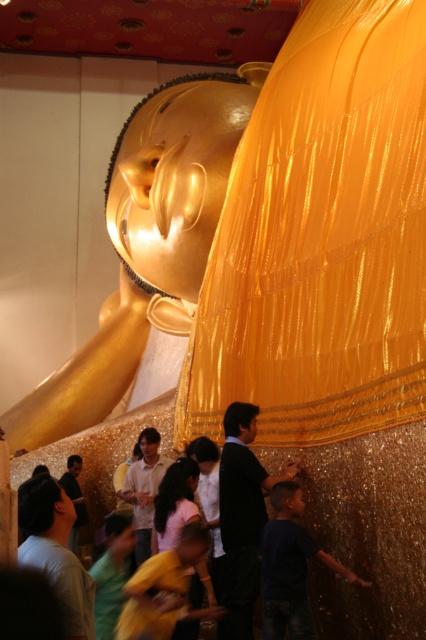
Where is `gold shiny statue at center`? This screenshot has height=640, width=426. gold shiny statue at center is located at coordinates (147, 243).

From the picture: Can you confirm if gold shiny statue at center is thinner than matte gold monk at center?

No, gold shiny statue at center is not thinner than matte gold monk at center.

The height and width of the screenshot is (640, 426). What do you see at coordinates (147, 243) in the screenshot? I see `gold shiny statue at center` at bounding box center [147, 243].

This screenshot has height=640, width=426. In order to click on gold shiny statue at center in this screenshot , I will do point(147,243).

Who is shorter, black matte monk at center or matte gold monk at center?

matte gold monk at center

Does black matte monk at center appear on the right side of matte gold monk at center?

Yes, black matte monk at center is to the right of matte gold monk at center.

This screenshot has width=426, height=640. I want to click on black matte monk at center, so click(241, 518).

Does gold shiny statue at center appear under black matte monk at center?

Actually, gold shiny statue at center is above black matte monk at center.

Who is shorter, gold shiny statue at center or black matte monk at center?

black matte monk at center is shorter.

Who is more forward, (95, 403) or (241, 404)?

Point (241, 404) is in front.

You are a GUI agent. You are given a task and a screenshot of the screen. Output one action in this format:
    pyautogui.click(x=<x>, y=<y>)
    Task: Click on the gold shiny statue at center
    
    Given the screenshot: What is the action you would take?
    pyautogui.click(x=147, y=243)